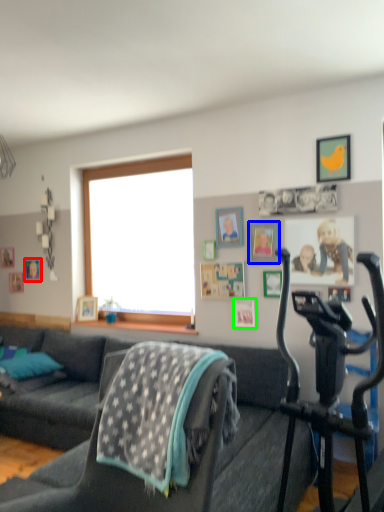
Question: Which object is the farthest from picture frame (highlighted by a red box)? Choose among these: picture frame (highlighted by a blue box) or picture frame (highlighted by a green box).

Choices:
 (A) picture frame
 (B) picture frame

Answer: (A)